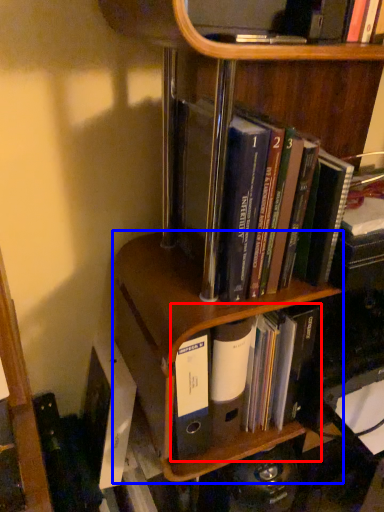
Question: Among these objects, which one is farthest to the camera, book (highlighted by a red box) or shelf (highlighted by a blue box)?

Choices:
 (A) book
 (B) shelf

Answer: (A)